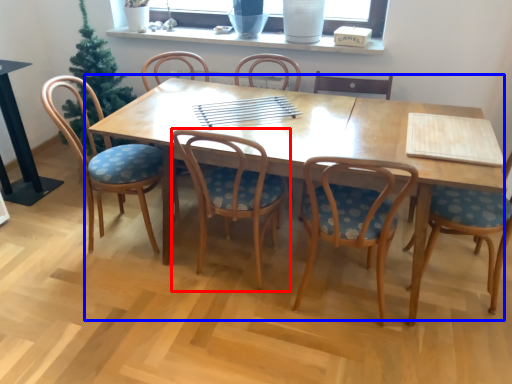
Question: Among these objects, which one is farthest to the camera, chair (highlighted by a red box) or kitchen & dining room table (highlighted by a blue box)?

Choices:
 (A) chair
 (B) kitchen & dining room table

Answer: (B)